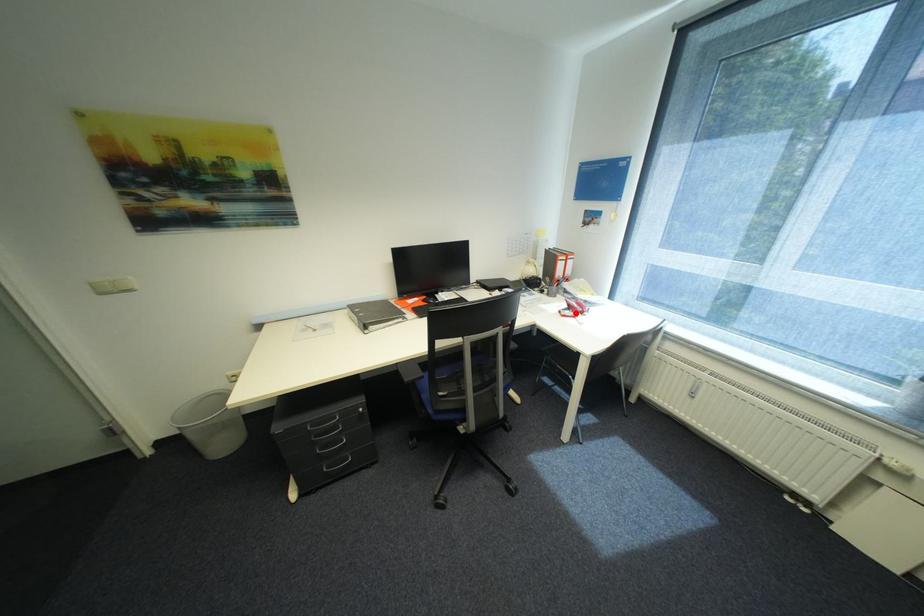
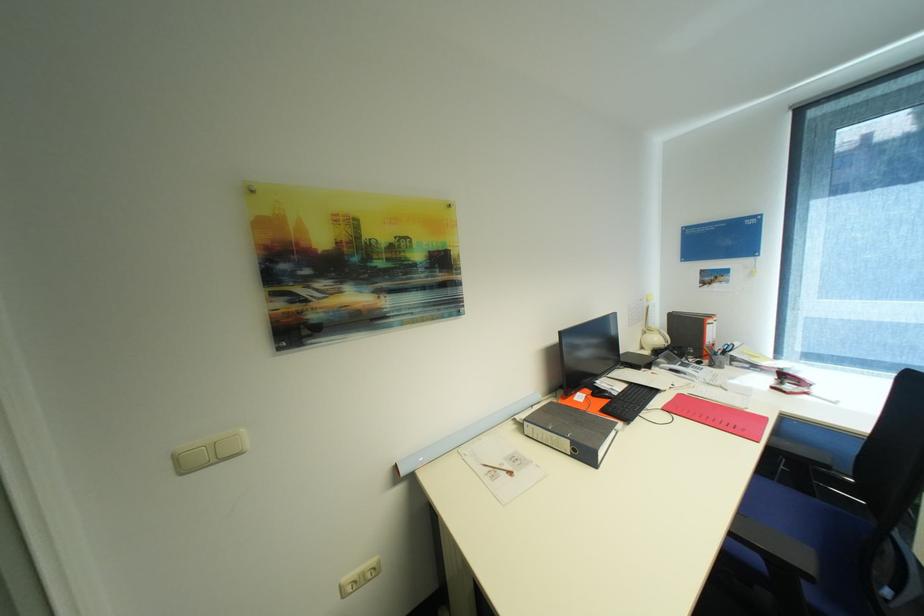
The point at the highlighted location is marked in the first image. Where is the corresponding point in the second image?

(796, 387)